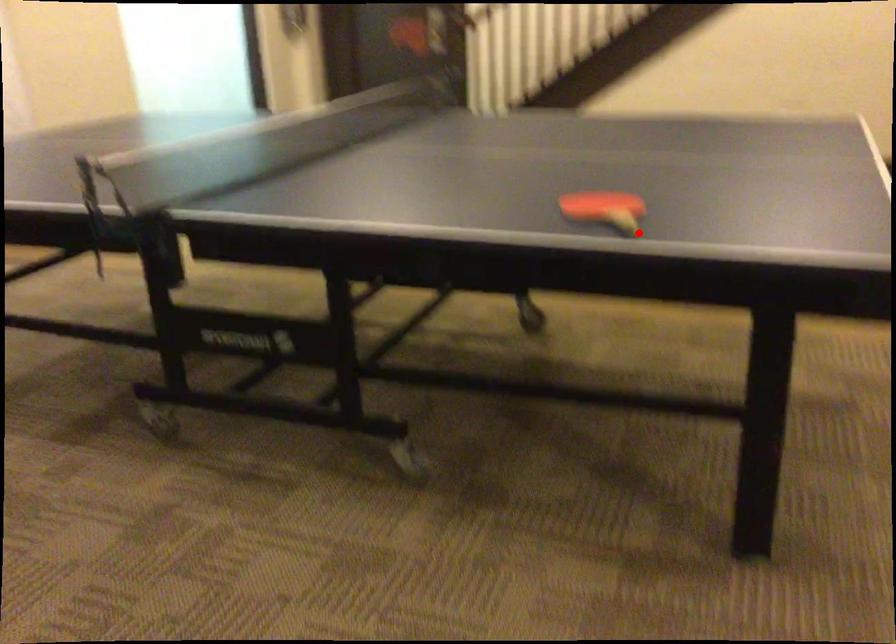
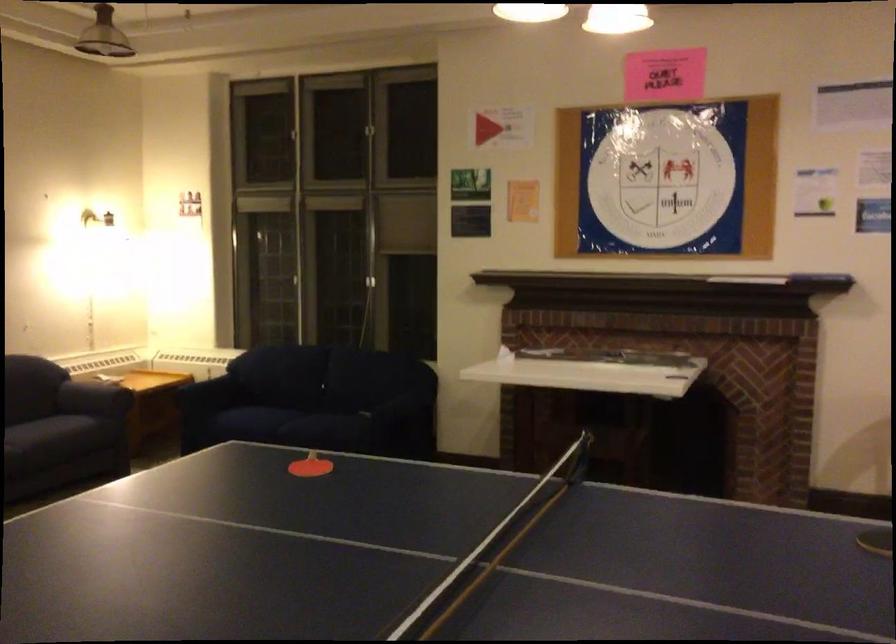
Question: I am providing you with two images of the same scene from different viewpoints. Given a red point in image1, look at the same physical point in image2. Is it:

Choices:
 (A) Closer to the viewpoint
 (B) Farther from the viewpoint

Answer: (B)